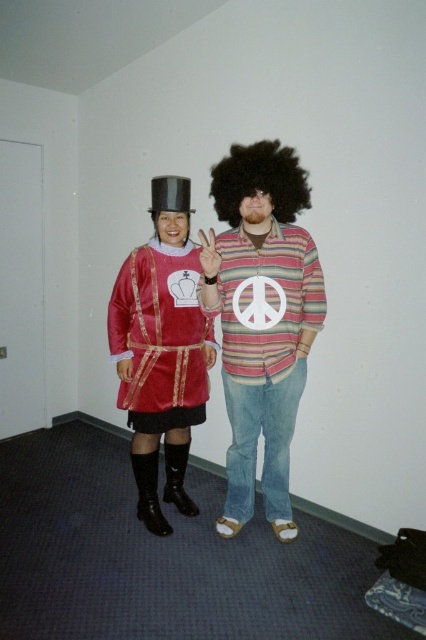
You are a photographer trying to capture a portrait of the two people in the image. You need to ensure that the striped cotton shirt at center and the afro at center are both clearly visible in the frame. Based on their positions, which one should you focus on first to ensure both are in focus?

The striped cotton shirt at center is located below the afro at center. To ensure both are in focus, focus on the afro at center first since it is higher up, allowing the striped cotton shirt at center below it to remain within the depth of field.

You are organizing a photo shoot and need to position the velvet red dress at left and the afro at center in a narrow hallway. Given their sizes, which one should you place closer to the wall to ensure both fit comfortably?

The velvet red dress at left has a larger width than the afro at center, so you should place the velvet red dress at left closer to the wall to accommodate its size while allowing the afro at center to have enough space.

You are organizing a themed costume party and need to arrange the striped cotton shirt at center and the velvet red dress at left on a display rack. Based on their positions in the image, which item should be placed higher on the rack?

The velvet red dress at left should be placed higher on the rack since the striped cotton shirt at center is located below it in the image.